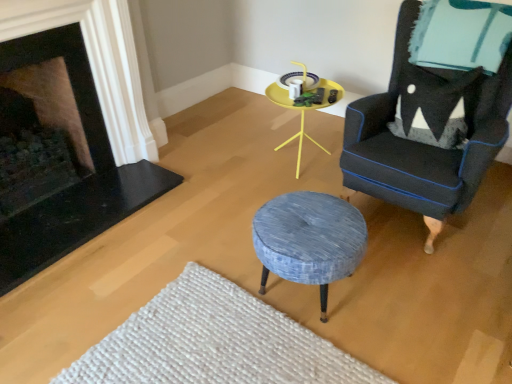
Image resolution: width=512 pixels, height=384 pixels. Identify the location of unoccupied region to the right of textured blue fabric stool at center. (402, 291).